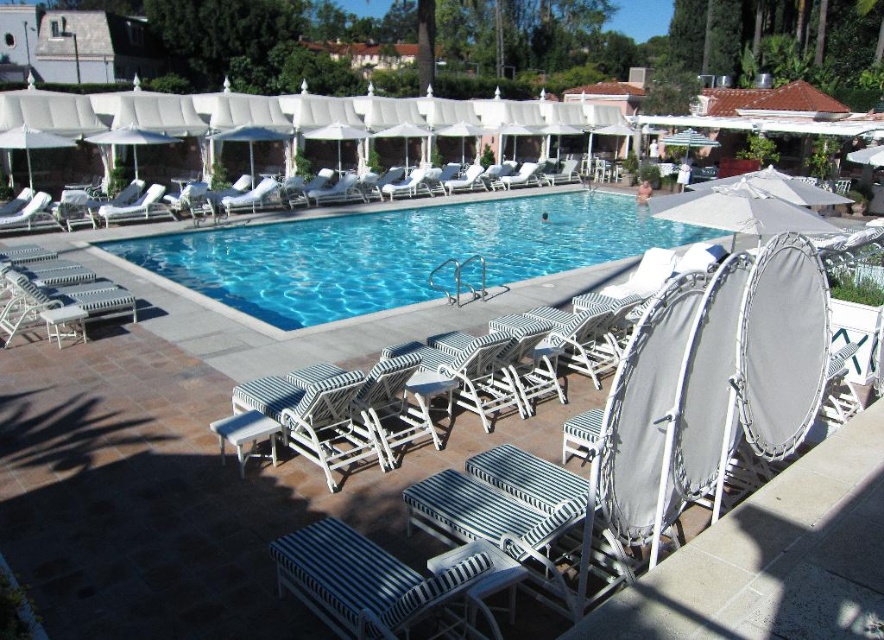
You are a guest at the resort and want to choose an umbrella that offers more shade. Which umbrella between the white fabric umbrella at upper center and the white fabric umbrella at upper left is taller?

The white fabric umbrella at upper left is taller than the white fabric umbrella at upper center, so it will provide more shade.

From the picture: You are a guest at this resort and want to move from your current position at the striped fabric lounge chair at center to the white fabric umbrella at upper right. The resort requires guests to maintain a minimum distance of 5 meters between themselves and others. If another guest is standing exactly halfway between the two objects, can you still proceed to the umbrella without violating the resort rules?

The distance between the striped fabric lounge chair at center and the white fabric umbrella at upper right is 7.79 meters. If another guest is halfway, they are 3.895 meters away from both. Since the minimum required distance is 5 meters, you would be too close to the guest. Therefore, you cannot proceed without violating the resort rules.

You are a guest at the resort and want to find a shaded area. You see two white fabric umbrellas in the pool area. Which umbrella, the white fabric umbrella at upper center or the white fabric umbrella at upper left, is located to the right of the other?

The white fabric umbrella at upper center is positioned on the right side of white fabric umbrella at upper left.